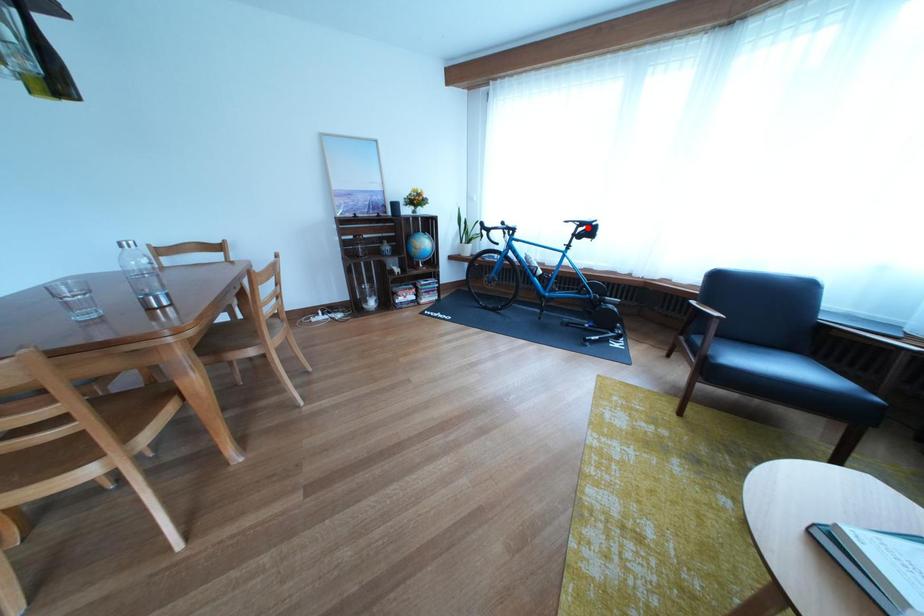
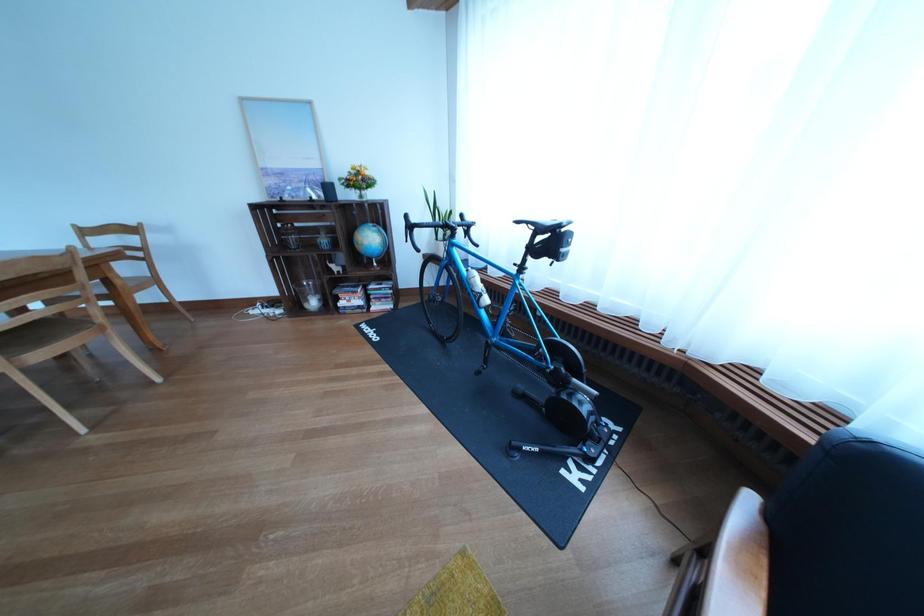
Question: I am providing you with two images of the same scene from different viewpoints. Given a red point in image1, look at the same physical point in image2. Is it:

Choices:
 (A) Closer to the viewpoint
 (B) Farther from the viewpoint

Answer: (B)